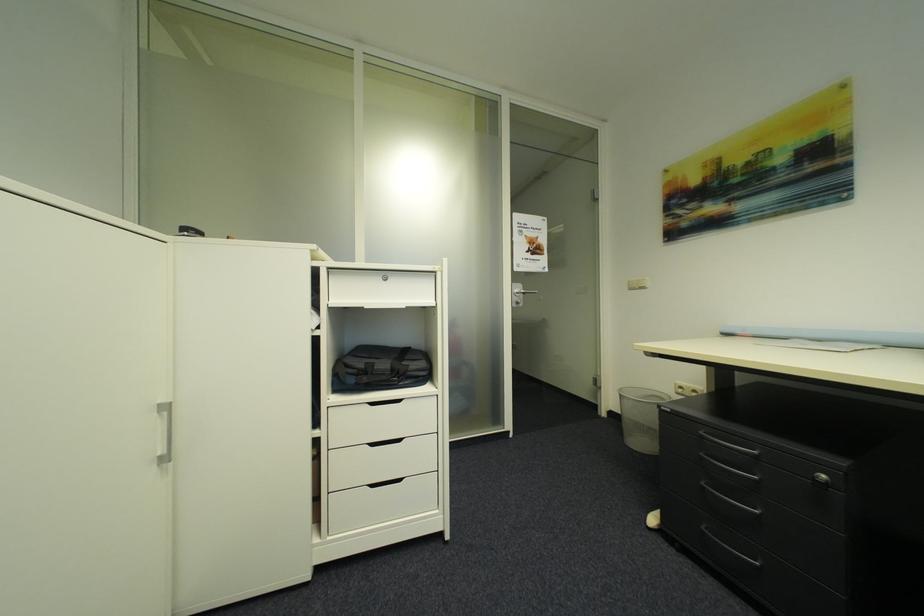
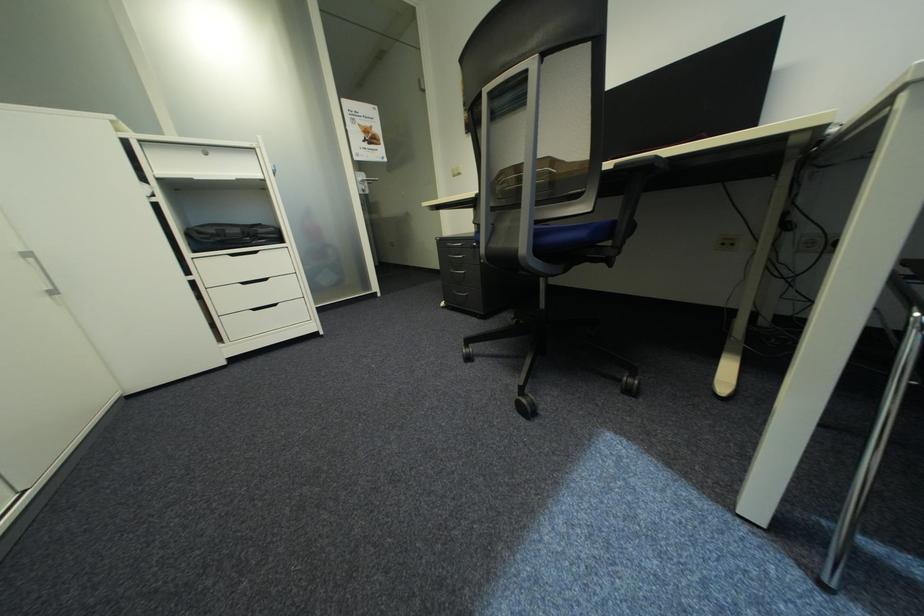
The point at [373,363] is marked in the first image. Where is the corresponding point in the second image?

(225, 230)